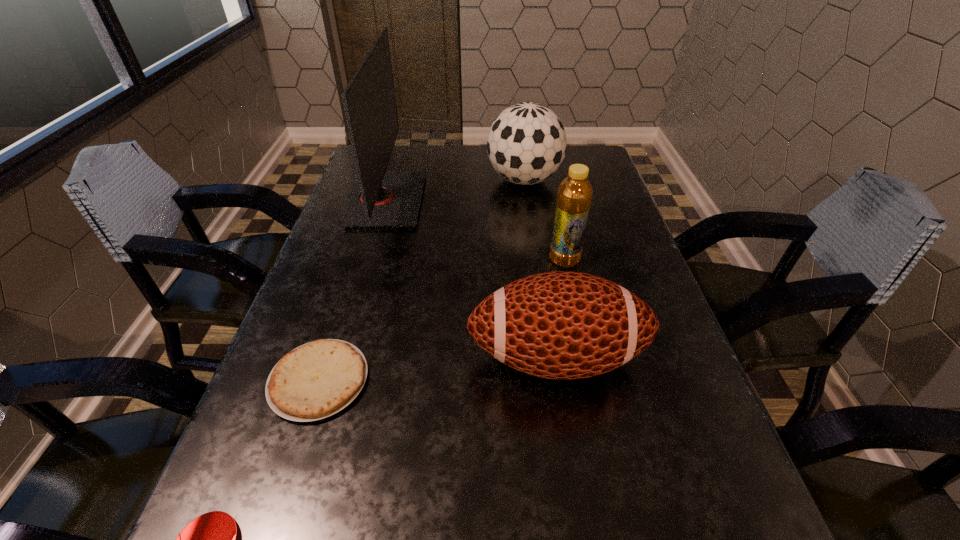
The width and height of the screenshot is (960, 540). What are the coordinates of `monitor at the far edge` in the screenshot? It's located at (380, 198).

The width and height of the screenshot is (960, 540). Find the location of `soccer ball that is at the far edge`. soccer ball that is at the far edge is located at coordinates pos(526,144).

I want to click on monitor that is at the left edge, so click(380, 198).

Where is `tortilla that is positioned at the left edge`? tortilla that is positioned at the left edge is located at coordinates (316, 380).

Identify the location of bottle that is at the right edge. The height and width of the screenshot is (540, 960). (574, 198).

Where is `soccer ball located in the right edge section of the desktop`? The height and width of the screenshot is (540, 960). soccer ball located in the right edge section of the desktop is located at coordinates (526, 144).

Locate an element on the screen. This screenshot has width=960, height=540. football located at the right edge is located at coordinates (563, 325).

Locate an element on the screen. The image size is (960, 540). object located in the far left corner section of the desktop is located at coordinates (380, 198).

What are the coordinates of `object located in the far right corner section of the desktop` in the screenshot? It's located at (526, 144).

The width and height of the screenshot is (960, 540). What are the coordinates of `vacant space at the far edge` in the screenshot? It's located at (456, 163).